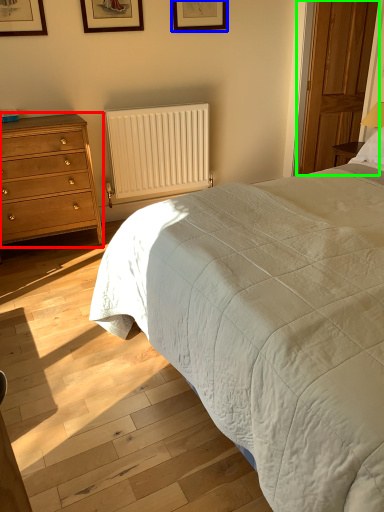
Question: Based on their relative distances, which object is nearer to chest of drawers (highlighted by a red box)? Choose from picture frame (highlighted by a blue box) and glass door (highlighted by a green box).

Choices:
 (A) picture frame
 (B) glass door

Answer: (A)